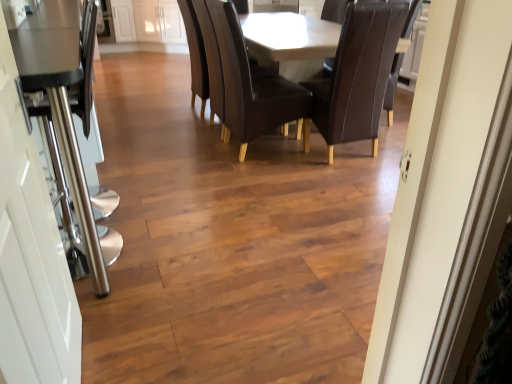
Question: Considering the relative sizes of brown leather chair at center, acting as the first chair starting from the left, and matte brown table at center in the image provided, is brown leather chair at center, acting as the first chair starting from the left, smaller than matte brown table at center?

Choices:
 (A) no
 (B) yes

Answer: (B)

Question: Is brown leather chair at center, which is the 2th chair from right to left, at the right side of matte brown table at center?

Choices:
 (A) no
 (B) yes

Answer: (A)

Question: Is brown leather chair at center, acting as the first chair starting from the left, far from matte brown table at center?

Choices:
 (A) no
 (B) yes

Answer: (A)

Question: Would you say matte brown table at center is part of brown leather chair at center, acting as the first chair starting from the left,'s contents?

Choices:
 (A) yes
 (B) no

Answer: (B)

Question: Is matte brown table at center at the back of brown leather chair at center, acting as the first chair starting from the left?

Choices:
 (A) no
 (B) yes

Answer: (B)

Question: Visually, is white glossy door at left positioned to the left or to the right of brown leather chair at center, the 1th chair from the right?

Choices:
 (A) left
 (B) right

Answer: (A)

Question: Which is correct: white glossy door at left is inside brown leather chair at center, the 2th chair when ordered from left to right, or outside of it?

Choices:
 (A) outside
 (B) inside

Answer: (A)

Question: From a real-world perspective, relative to brown leather chair at center, the 1th chair from the right, is white glossy door at left vertically above or below?

Choices:
 (A) above
 (B) below

Answer: (A)

Question: Based on their sizes in the image, would you say white glossy door at left is bigger or smaller than brown leather chair at center, the 2th chair when ordered from left to right?

Choices:
 (A) small
 (B) big

Answer: (A)

Question: Considering the positions of dark brown leather armchair at center and white glossy door at left in the image, is dark brown leather armchair at center taller or shorter than white glossy door at left?

Choices:
 (A) short
 (B) tall

Answer: (A)

Question: Would you say dark brown leather armchair at center is to the left or to the right of white glossy door at left in the picture?

Choices:
 (A) right
 (B) left

Answer: (A)

Question: Based on their sizes in the image, would you say dark brown leather armchair at center is bigger or smaller than white glossy door at left?

Choices:
 (A) big
 (B) small

Answer: (A)

Question: From a real-world perspective, relative to white glossy door at left, is dark brown leather armchair at center vertically above or below?

Choices:
 (A) below
 (B) above

Answer: (A)

Question: In terms of size, does dark brown leather armchair at center appear bigger or smaller than brown leather chair at center, the 1th chair from the right?

Choices:
 (A) big
 (B) small

Answer: (B)

Question: Considering the positions of dark brown leather armchair at center and brown leather chair at center, the 2th chair when ordered from left to right, in the image, is dark brown leather armchair at center wider or thinner than brown leather chair at center, the 2th chair when ordered from left to right,?

Choices:
 (A) thin
 (B) wide

Answer: (A)